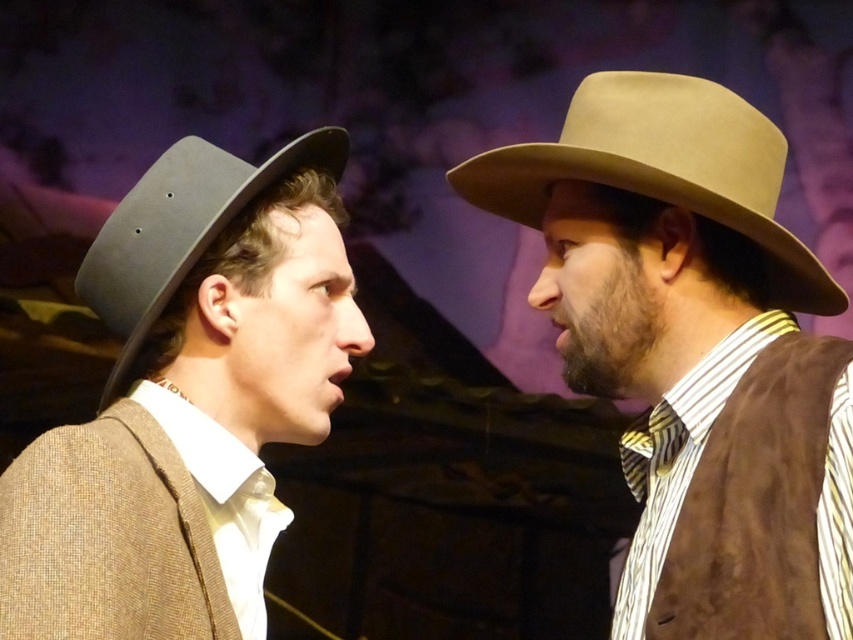
Question: Can you confirm if beige felt hat at center is positioned below suede-like beige cowboy hat at right?

Choices:
 (A) yes
 (B) no

Answer: (A)

Question: Which point is farther from the camera taking this photo?

Choices:
 (A) (223, 179)
 (B) (663, 413)
 (C) (228, 406)

Answer: (B)

Question: Can you confirm if matte black hat at left is bigger than matte black fedora at left?

Choices:
 (A) no
 (B) yes

Answer: (B)

Question: Which of the following is the closest to the observer?

Choices:
 (A) (119, 264)
 (B) (772, 328)

Answer: (A)

Question: Which of the following is the farthest from the observer?

Choices:
 (A) (677, 496)
 (B) (509, 205)
 (C) (804, 448)

Answer: (B)

Question: Does beige felt hat at center have a larger size compared to matte black hat at left?

Choices:
 (A) no
 (B) yes

Answer: (B)